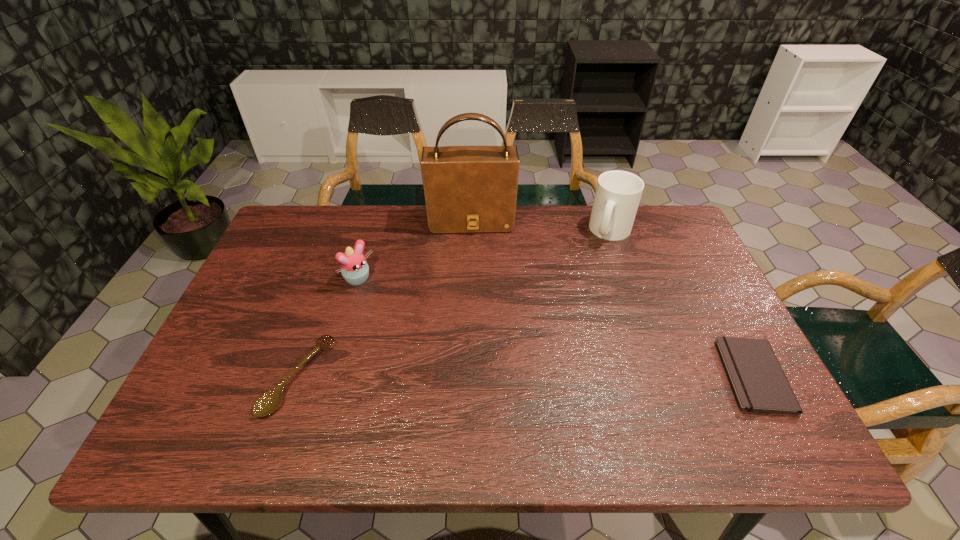
The image size is (960, 540). I want to click on vacant area located on the left of the rightmost object, so click(594, 375).

The height and width of the screenshot is (540, 960). I want to click on free space located 0.260m on the handle side of the mug, so click(597, 307).

Locate an element on the screen. free space located 0.280m on the handle side of the mug is located at coordinates (595, 312).

Find the location of a particular element. Image resolution: width=960 pixels, height=540 pixels. free point located 0.200m on the handle side of the mug is located at coordinates (600, 292).

You are a GUI agent. You are given a task and a screenshot of the screen. Output one action in this format:
    pyautogui.click(x=<x>, y=<y>)
    Task: Click on the vacant space located 0.170m on the face of the third tallest object
    The height and width of the screenshot is (540, 960).
    Given the screenshot: What is the action you would take?
    [x=409, y=321]

I want to click on vacant region located on the face of the third tallest object, so click(x=424, y=333).

Where is `free space located 0.370m on the face of the third tallest object`? The image size is (960, 540). free space located 0.370m on the face of the third tallest object is located at coordinates (464, 364).

What are the coordinates of `vacant space situated on the front flap of the tallest object` in the screenshot? It's located at (473, 267).

Identify the location of vacant position located on the front flap of the tallest object. (474, 297).

Locate an element on the screen. The width and height of the screenshot is (960, 540). vacant region located on the front flap of the tallest object is located at coordinates (473, 277).